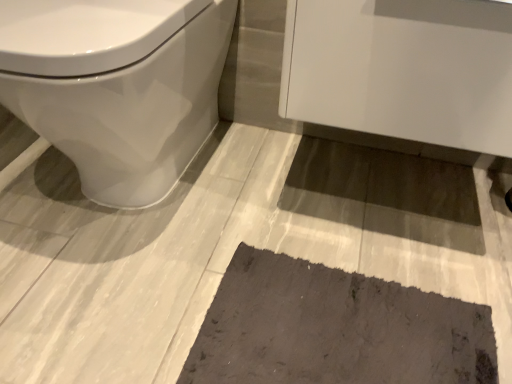
Find the location of a particular element. This screenshot has height=384, width=512. free area behind dark gray textured bath mat at lower center is located at coordinates [x=326, y=204].